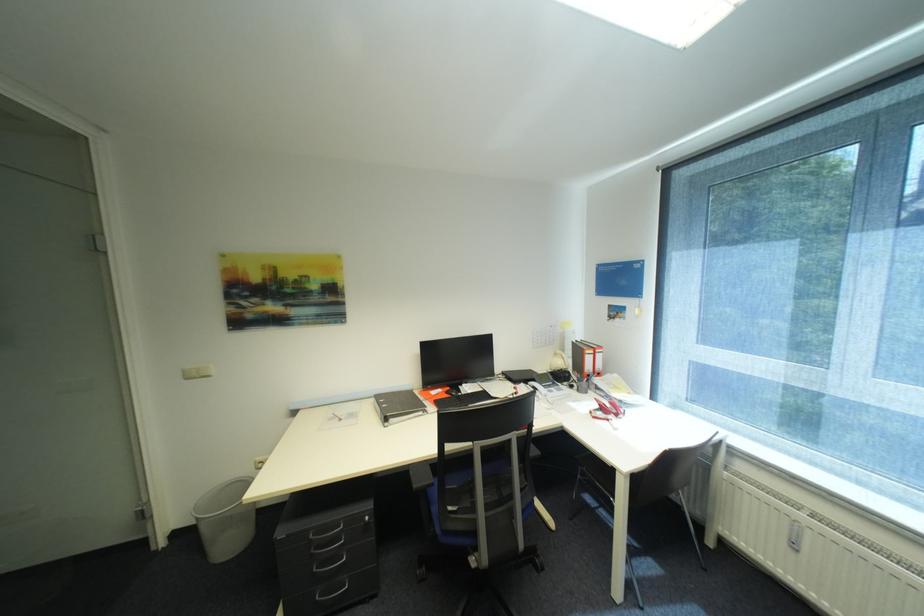
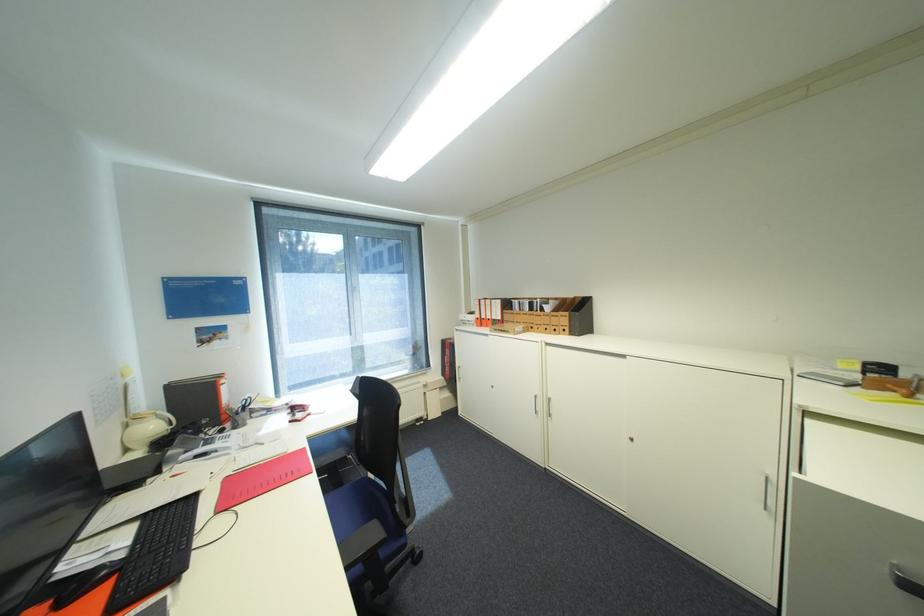
The point at (567, 363) is marked in the first image. Where is the corresponding point in the second image?

(161, 427)